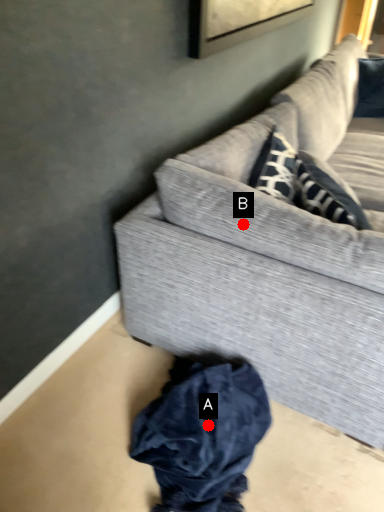
Question: Two points are circled on the image, labeled by A and B beside each circle. Which point appears closest to the camera in this image?

Choices:
 (A) A is closer
 (B) B is closer

Answer: (B)